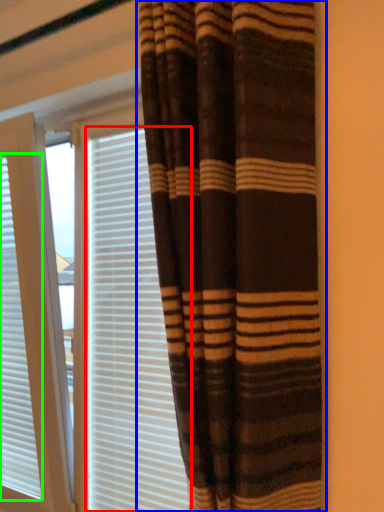
Question: Which object is positioned closest to blind (highlighted by a red box)? Select from curtain (highlighted by a blue box) and window blind (highlighted by a green box).

Choices:
 (A) curtain
 (B) window blind

Answer: (B)